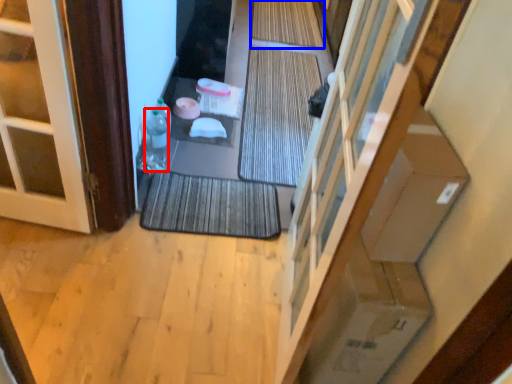
Question: Which object is further to the camera taking this photo, bottle (highlighted by a red box) or bath mat (highlighted by a blue box)?

Choices:
 (A) bottle
 (B) bath mat

Answer: (B)